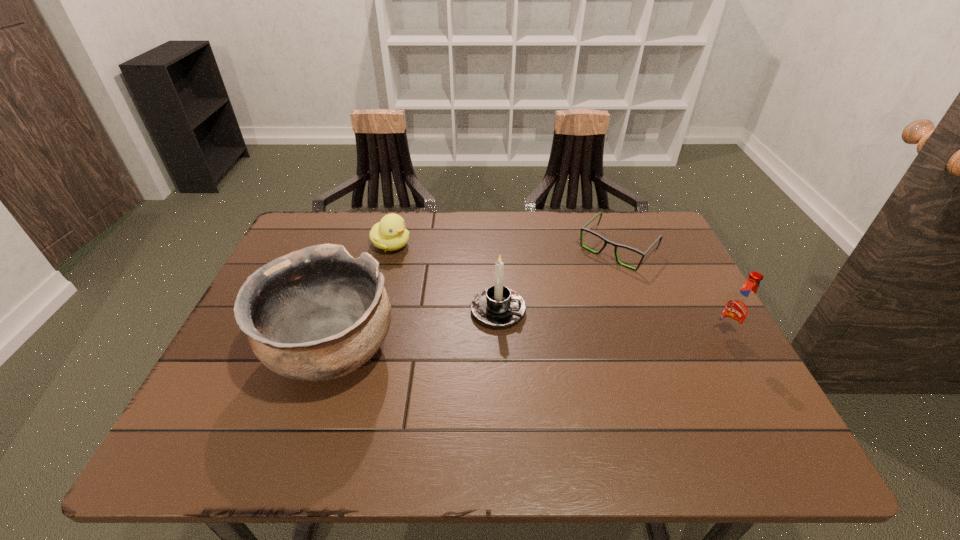
At what (x,y) coordinates should I click in order to perform the action: click on vacant space on the desktop that is between the pottery and the root beer and is positioned with a handle on the side of the candle holder. Please return your answer as a coordinate pair (x, y). Image resolution: width=960 pixels, height=540 pixels. Looking at the image, I should click on (586, 342).

The height and width of the screenshot is (540, 960). I want to click on free spot on the desktop that is between the pottery and the rightmost object and is positioned on the lens of the fourth object from left to right, so click(522, 345).

Find the location of a particular element. The width and height of the screenshot is (960, 540). vacant space on the desktop that is between the pottery and the rightmost object and is positioned at the beak of the second shortest object is located at coordinates (x=560, y=343).